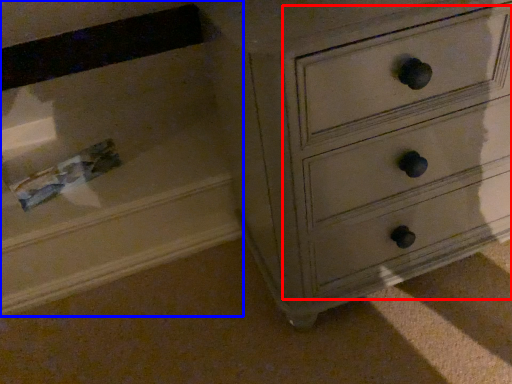
Question: Which object appears closest to the camera in this image, drawer (highlighted by a red box) or drawer (highlighted by a blue box)?

Choices:
 (A) drawer
 (B) drawer

Answer: (A)